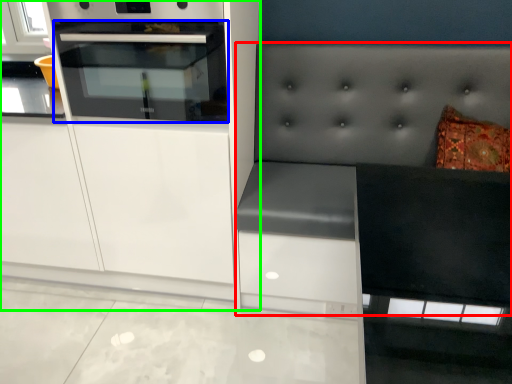
Question: Considering the real-world distances, which object is closest to couch (highlighted by a red box)? oven (highlighted by a blue box) or cabinetry (highlighted by a green box).

Choices:
 (A) oven
 (B) cabinetry

Answer: (B)